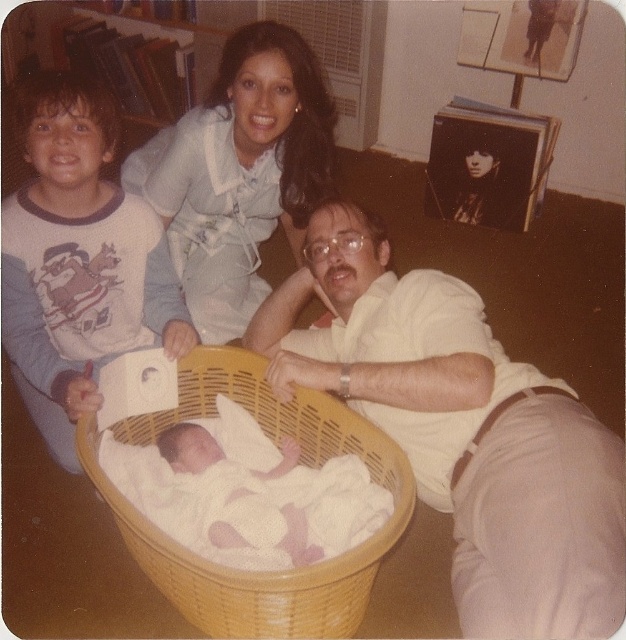
Question: Considering the relative positions of woven yellow basket at center and white soft cloth at center in the image provided, where is woven yellow basket at center located with respect to white soft cloth at center?

Choices:
 (A) above
 (B) below

Answer: (B)

Question: Is white matte shirt at center to the left of woven yellow basket at center from the viewer's perspective?

Choices:
 (A) yes
 (B) no

Answer: (B)

Question: Which object appears closest to the camera in this image?

Choices:
 (A) white matte shirt at center
 (B) white soft cloth at center
 (C) woven yellow basket at center
 (D) light blue fabric dress at upper center

Answer: (A)

Question: Which object appears farthest from the camera in this image?

Choices:
 (A) white matte shirt at center
 (B) white soft cloth at center
 (C) light blue fabric dress at upper center
 (D) white soft fabric newborn at lower left

Answer: (C)

Question: Which point is closer to the camera?

Choices:
 (A) white matte shirt at center
 (B) white soft cloth at center

Answer: (A)

Question: Is white matte shirt at center below light blue fabric dress at upper center?

Choices:
 (A) no
 (B) yes

Answer: (B)